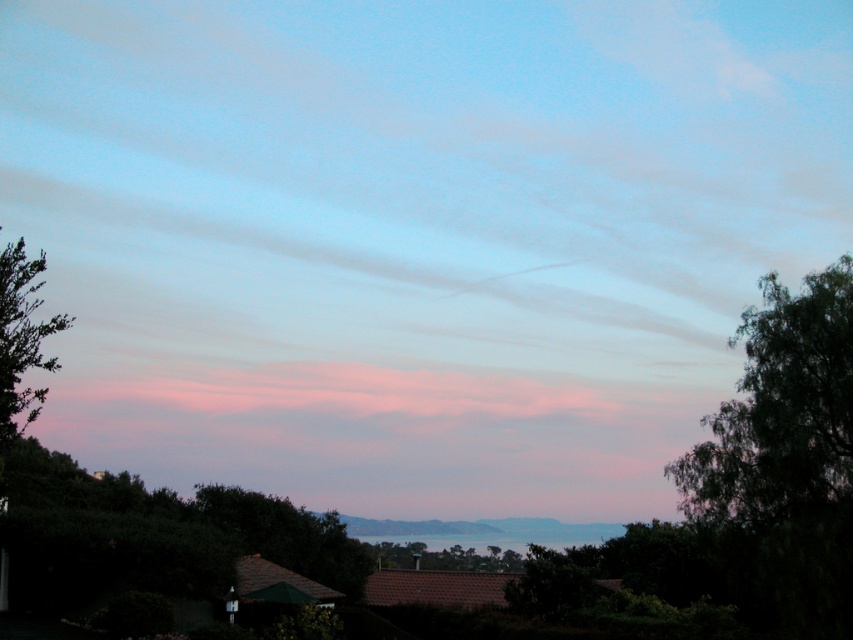
Question: From the image, what is the correct spatial relationship of green leafy tree at left in relation to green leafy tree at center?

Choices:
 (A) below
 (B) above

Answer: (B)

Question: Is green leafy tree at left further to the viewer compared to green leafy tree at center?

Choices:
 (A) yes
 (B) no

Answer: (B)

Question: Which point is farther to the camera?

Choices:
 (A) green leafy tree at left
 (B) green leafy tree at center

Answer: (B)

Question: Is the position of green leafy tree at left less distant than that of green leafy tree at center?

Choices:
 (A) yes
 (B) no

Answer: (A)

Question: Which point is closer to the camera?

Choices:
 (A) (22, 412)
 (B) (438, 556)

Answer: (A)